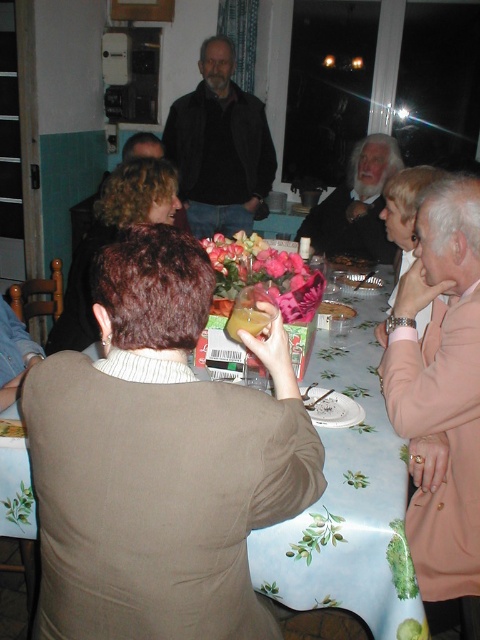
Who is taller, curly hair at center or white ceramic platter at center?

With more height is curly hair at center.

Is point (58, 321) in front of point (320, 406)?

No, (58, 321) is behind (320, 406).

The height and width of the screenshot is (640, 480). What are the coordinates of `curly hair at center` in the screenshot? It's located at (111, 240).

Which is more to the right, black leather jacket at upper center or dark brown leather jacket at upper center?

dark brown leather jacket at upper center is more to the right.

At what (x,y) coordinates should I click in order to perform the action: click on black leather jacket at upper center. Please return your answer as a coordinate pair (x, y). The height and width of the screenshot is (640, 480). Looking at the image, I should click on (219, 147).

Locate an element on the screen. Image resolution: width=480 pixels, height=640 pixels. black leather jacket at upper center is located at coordinates (219, 147).

Which of these two, curly hair at center or smooth plastic bowl at center, stands shorter?

Standing shorter between the two is smooth plastic bowl at center.

Does curly hair at center lie in front of smooth plastic bowl at center?

Yes.

Find the location of a particular element. curly hair at center is located at coordinates (111, 240).